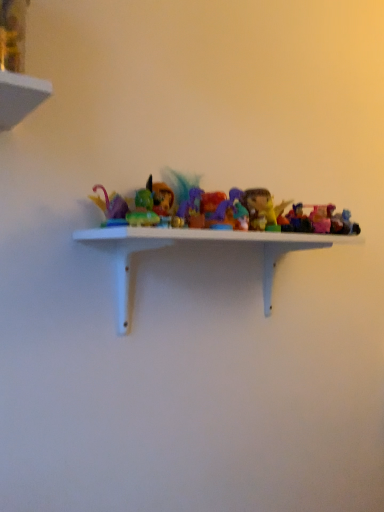
Question: In which direction should I rotate to look at translucent plastic toy at center, which appears as the 2th toy when viewed from the right?

Choices:
 (A) right
 (B) left

Answer: (A)

Question: Is translucent plastic toy at center, marked as the 3th toy in a right-to-left arrangement, outside translucent plastic toy at center, which appears as the 2th toy when viewed from the right?

Choices:
 (A) yes
 (B) no

Answer: (A)

Question: From a real-world perspective, is translucent plastic toy at center, marked as the 3th toy in a right-to-left arrangement, on top of translucent plastic toy at center, which ranks as the 5th toy in left-to-right order?

Choices:
 (A) no
 (B) yes

Answer: (B)

Question: From the image's perspective, would you say translucent plastic toy at center, marked as the 3th toy in a right-to-left arrangement, is positioned over translucent plastic toy at center, which ranks as the 5th toy in left-to-right order?

Choices:
 (A) no
 (B) yes

Answer: (B)

Question: Can you confirm if translucent plastic toy at center, which appears as the fourth toy when viewed from the left, is smaller than translucent plastic toy at center, which ranks as the 5th toy in left-to-right order?

Choices:
 (A) no
 (B) yes

Answer: (A)

Question: Would you say translucent plastic toy at center, which appears as the fourth toy when viewed from the left, contains translucent plastic toy at center, which appears as the 2th toy when viewed from the right?

Choices:
 (A) yes
 (B) no

Answer: (B)

Question: Is translucent plastic toy at center, marked as the 3th toy in a right-to-left arrangement, facing towards translucent plastic toy at center, which ranks as the 5th toy in left-to-right order?

Choices:
 (A) yes
 (B) no

Answer: (B)

Question: Does translucent purple figurine at center, placed as the fifth toy when sorted from right to left, have a greater width compared to matte green toy at center, positioned as the 6th toy in right-to-left order?

Choices:
 (A) no
 (B) yes

Answer: (A)

Question: From the image's perspective, would you say translucent purple figurine at center, placed as the fifth toy when sorted from right to left, is positioned over matte green toy at center, which is the 1th toy from left to right?

Choices:
 (A) yes
 (B) no

Answer: (A)

Question: Is translucent purple figurine at center, placed as the fifth toy when sorted from right to left, bigger than matte green toy at center, positioned as the 6th toy in right-to-left order?

Choices:
 (A) no
 (B) yes

Answer: (B)

Question: Does translucent purple figurine at center, which is counted as the second toy, starting from the left, come behind matte green toy at center, positioned as the 6th toy in right-to-left order?

Choices:
 (A) yes
 (B) no

Answer: (A)

Question: Does translucent purple figurine at center, placed as the fifth toy when sorted from right to left, have a lesser height compared to matte green toy at center, positioned as the 6th toy in right-to-left order?

Choices:
 (A) yes
 (B) no

Answer: (B)

Question: Considering the relative sizes of translucent purple figurine at center, which is counted as the second toy, starting from the left, and matte green toy at center, positioned as the 6th toy in right-to-left order, in the image provided, is translucent purple figurine at center, which is counted as the second toy, starting from the left, taller than matte green toy at center, positioned as the 6th toy in right-to-left order,?

Choices:
 (A) no
 (B) yes

Answer: (B)

Question: Is matte green toy at center, which is the 1th toy from left to right, next to translucent plastic toy at center, marked as the 3th toy in a right-to-left arrangement, and touching it?

Choices:
 (A) yes
 (B) no

Answer: (B)